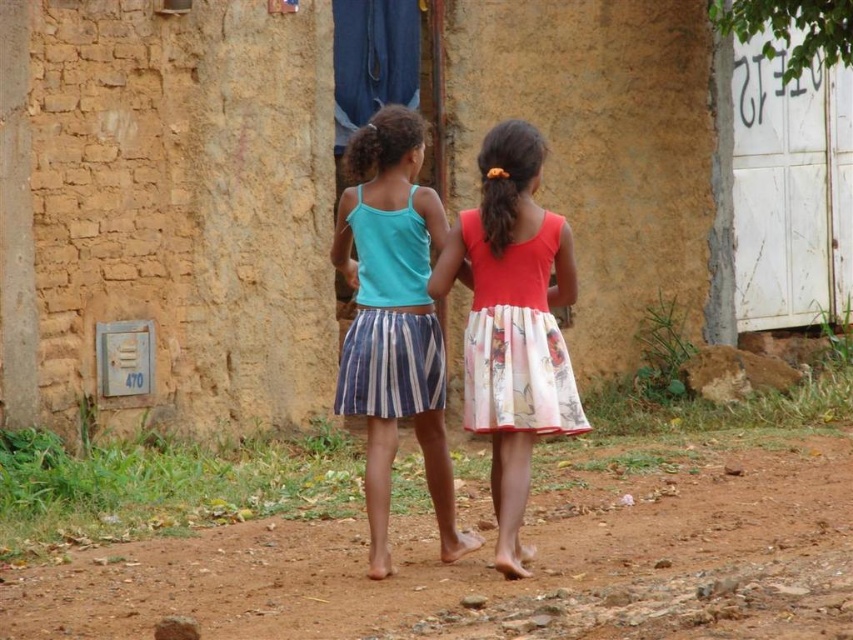
You are a photographer standing in front of the mud brick wall. You see two dresses hanging on the wall in front of you. The dresses are the floral cotton dress at center and the striped cotton dress at center. Which dress is hanging lower on the wall?

The floral cotton dress at center is located below the striped cotton dress at center, so it is hanging lower on the wall.

You are standing in a rural area with two girls walking away from you on a dirt path. You notice two points marked on the ground. The first point is at coordinates point (505, 637) and the second point is at point (497, 512). Which of these points is closer to you?

Point (505, 637) is closer to the viewer than point (497, 512).

You are standing at the origin point in the image. The floral cotton dress at center is located at point (515, 337). What is the exact coordinate of the floral cotton dress at center?

The floral cotton dress at center is exactly at coordinate point (515, 337).